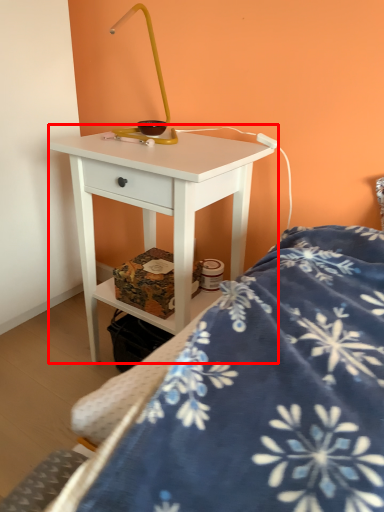
Question: Where is nightstand (annotated by the red box) located in relation to bed in the image?

Choices:
 (A) right
 (B) left

Answer: (B)